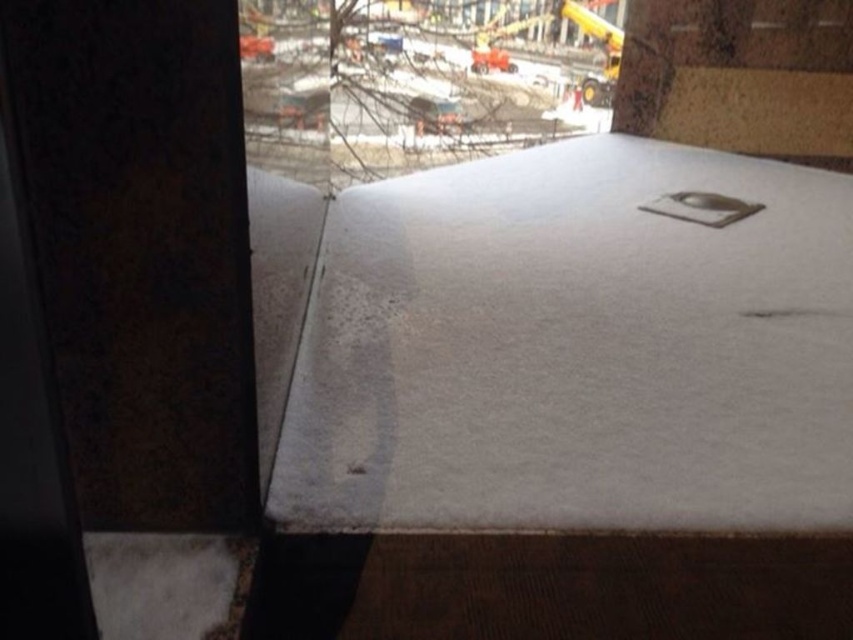
You are standing 6 feet away from the white matte blanket at center. Can you reach it without moving your feet?

The white matte blanket at center is 6.72 feet away from the viewer. Since you are standing 6 feet away, you are still 0.72 feet away from it, so you cannot reach it without moving your feet.

You are a delivery person who just arrived at the window ledge to drop off a package. You have two items to place on the snow covered ledge. The white matte blanket at center and the white cardboard box at upper right. Which item will you place first if you want to ensure both items fit on the ledge without overlapping?

You should place the white cardboard box at upper right first because it is smaller than the white matte blanket at center, allowing more space for the larger item to be placed afterward without overlapping.

You are an architect reviewing a winter construction site. You notice the transparent glass window at upper center and the white cardboard box at upper right. Which object is taller?

The white cardboard box at upper right is taller than the transparent glass window at upper center.